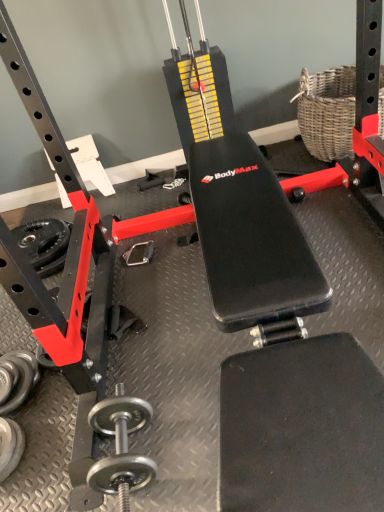
Identify the location of silver metallic dumbbell at lower left, marked as the first dumbbell in a left-to-right arrangement. This screenshot has height=512, width=384. (17, 379).

You are a GUI agent. You are given a task and a screenshot of the screen. Output one action in this format:
    pyautogui.click(x=<x>, y=<y>)
    Task: Click on the woven wicker basket at upper right
    The height and width of the screenshot is (512, 384).
    Given the screenshot: What is the action you would take?
    pyautogui.click(x=327, y=112)

Locate an element on the screen. This screenshot has width=384, height=512. rubberized black weight at lower left is located at coordinates (43, 240).

Is silver metallic dumbbell at lower left, which is the third dumbbell in right-to-left order, oriented away from rubberized black weight at lower left?

No.

Does silver metallic dumbbell at lower left, marked as the first dumbbell in a left-to-right arrangement, appear on the right side of rubberized black weight at lower left?

Correct, you'll find silver metallic dumbbell at lower left, marked as the first dumbbell in a left-to-right arrangement, to the right of rubberized black weight at lower left.

From the image's perspective, which is above, silver metallic dumbbell at lower left, marked as the first dumbbell in a left-to-right arrangement, or rubberized black weight at lower left?

From the image's view, rubberized black weight at lower left is above.

From a real-world perspective, is silver metallic dumbbell at lower left, which is the third dumbbell in right-to-left order, beneath rubberized black weight at lower left?

Yes, from a real-world perspective, silver metallic dumbbell at lower left, which is the third dumbbell in right-to-left order, is under rubberized black weight at lower left.

In terms of width, does woven wicker basket at upper right look wider or thinner when compared to silver metallic dumbbell at lower left, the 2th dumbbell positioned from the left?

Considering their sizes, woven wicker basket at upper right looks broader than silver metallic dumbbell at lower left, the 2th dumbbell positioned from the left.

From a real-world perspective, is woven wicker basket at upper right on top of silver metallic dumbbell at lower left, placed as the 2th dumbbell when sorted from right to left?

Yes, from a real-world perspective, woven wicker basket at upper right is over silver metallic dumbbell at lower left, placed as the 2th dumbbell when sorted from right to left

Is woven wicker basket at upper right taller than silver metallic dumbbell at lower left, placed as the 2th dumbbell when sorted from right to left?

Yes, woven wicker basket at upper right is taller than silver metallic dumbbell at lower left, placed as the 2th dumbbell when sorted from right to left.

Is point (59, 227) behind point (338, 71)?

No, (59, 227) is closer to viewer.

Consider the image. Is rubberized black weight at lower left at the right side of woven wicker basket at upper right?

No.

Which object is closer to the camera taking this photo, rubberized black weight at lower left or woven wicker basket at upper right?

woven wicker basket at upper right is closer to the camera.

From the image's perspective, is rubberized black weight at lower left on woven wicker basket at upper right?

Incorrect, from the image's perspective, rubberized black weight at lower left is lower than woven wicker basket at upper right.

Is the depth of silver metallic dumbbell at lower left, placed as the 2th dumbbell when sorted from right to left, greater than that of rubberized black weight at lower left?

No, silver metallic dumbbell at lower left, placed as the 2th dumbbell when sorted from right to left, is closer to the viewer.

From the image's perspective, between silver metallic dumbbell at lower left, the 2th dumbbell positioned from the left, and rubberized black weight at lower left, which one is located above?

From the image's view, rubberized black weight at lower left is above.

Is point (0, 463) positioned behind point (48, 254)?

That is False.

Can you see silver metallic dumbbell at lower left, placed as the 2th dumbbell when sorted from right to left, touching rubberized black weight at lower left?

No, silver metallic dumbbell at lower left, placed as the 2th dumbbell when sorted from right to left, is not beside rubberized black weight at lower left.

Is polished silver dumbbell at lower left, marked as the first dumbbell in a right-to-left arrangement, thinner than silver metallic dumbbell at lower left, the 2th dumbbell positioned from the left?

Incorrect, the width of polished silver dumbbell at lower left, marked as the first dumbbell in a right-to-left arrangement, is not less than that of silver metallic dumbbell at lower left, the 2th dumbbell positioned from the left.

Visually, is polished silver dumbbell at lower left, marked as the first dumbbell in a right-to-left arrangement, positioned to the left or to the right of silver metallic dumbbell at lower left, the 2th dumbbell positioned from the left?

Clearly, polished silver dumbbell at lower left, marked as the first dumbbell in a right-to-left arrangement, is on the right of silver metallic dumbbell at lower left, the 2th dumbbell positioned from the left, in the image.

Could you measure the distance between polished silver dumbbell at lower left, marked as the first dumbbell in a right-to-left arrangement, and silver metallic dumbbell at lower left, placed as the 2th dumbbell when sorted from right to left?

The distance of polished silver dumbbell at lower left, marked as the first dumbbell in a right-to-left arrangement, from silver metallic dumbbell at lower left, placed as the 2th dumbbell when sorted from right to left, is 12.83 inches.

Who is taller, polished silver dumbbell at lower left, which ranks as the third dumbbell in left-to-right order, or silver metallic dumbbell at lower left, the 2th dumbbell positioned from the left?

With more height is polished silver dumbbell at lower left, which ranks as the third dumbbell in left-to-right order.

Is woven wicker basket at upper right oriented away from polished silver dumbbell at lower left, marked as the first dumbbell in a right-to-left arrangement?

woven wicker basket at upper right is not turned away from polished silver dumbbell at lower left, marked as the first dumbbell in a right-to-left arrangement.

Which of these two, woven wicker basket at upper right or polished silver dumbbell at lower left, which ranks as the third dumbbell in left-to-right order, is bigger?

woven wicker basket at upper right is bigger.

Is woven wicker basket at upper right positioned in front of polished silver dumbbell at lower left, which ranks as the third dumbbell in left-to-right order?

No, woven wicker basket at upper right is further to the viewer.

In terms of height, does silver metallic dumbbell at lower left, which is the third dumbbell in right-to-left order, look taller or shorter compared to polished silver dumbbell at lower left, marked as the first dumbbell in a right-to-left arrangement?

Considering their sizes, silver metallic dumbbell at lower left, which is the third dumbbell in right-to-left order, has less height than polished silver dumbbell at lower left, marked as the first dumbbell in a right-to-left arrangement.

Which is more to the left, silver metallic dumbbell at lower left, marked as the first dumbbell in a left-to-right arrangement, or polished silver dumbbell at lower left, marked as the first dumbbell in a right-to-left arrangement?

silver metallic dumbbell at lower left, marked as the first dumbbell in a left-to-right arrangement.

From the image's perspective, which is below, silver metallic dumbbell at lower left, which is the third dumbbell in right-to-left order, or polished silver dumbbell at lower left, which ranks as the third dumbbell in left-to-right order?

polished silver dumbbell at lower left, which ranks as the third dumbbell in left-to-right order, appears lower in the image.

This screenshot has width=384, height=512. In order to click on wheel above the silver metallic dumbbell at lower left, marked as the first dumbbell in a left-to-right arrangement (from the image's perspective) in this screenshot , I will do `click(43, 240)`.

Find the location of a particular element. the 2nd dumbbell to the left when counting from the woven wicker basket at upper right is located at coordinates (10, 446).

Looking at the image, which one is located further to polished silver dumbbell at lower left, which ranks as the third dumbbell in left-to-right order, silver metallic dumbbell at lower left, placed as the 2th dumbbell when sorted from right to left, or silver metallic dumbbell at lower left, marked as the first dumbbell in a left-to-right arrangement?

Among the two, silver metallic dumbbell at lower left, marked as the first dumbbell in a left-to-right arrangement, is located further to polished silver dumbbell at lower left, which ranks as the third dumbbell in left-to-right order.

From the image, which object appears to be nearer to silver metallic dumbbell at lower left, placed as the 2th dumbbell when sorted from right to left, polished silver dumbbell at lower left, which ranks as the third dumbbell in left-to-right order, or woven wicker basket at upper right?

polished silver dumbbell at lower left, which ranks as the third dumbbell in left-to-right order, is positioned closer to the anchor silver metallic dumbbell at lower left, placed as the 2th dumbbell when sorted from right to left.

When comparing their distances from silver metallic dumbbell at lower left, the 2th dumbbell positioned from the left, does woven wicker basket at upper right or polished silver dumbbell at lower left, which ranks as the third dumbbell in left-to-right order, seem closer?

The object closer to silver metallic dumbbell at lower left, the 2th dumbbell positioned from the left, is polished silver dumbbell at lower left, which ranks as the third dumbbell in left-to-right order.

Looking at the image, which one is located further to woven wicker basket at upper right, polished silver dumbbell at lower left, which ranks as the third dumbbell in left-to-right order, or silver metallic dumbbell at lower left, placed as the 2th dumbbell when sorted from right to left?

silver metallic dumbbell at lower left, placed as the 2th dumbbell when sorted from right to left, lies further to woven wicker basket at upper right than the other object.

Consider the image. From the image, which object appears to be nearer to rubberized black weight at lower left, silver metallic dumbbell at lower left, placed as the 2th dumbbell when sorted from right to left, or polished silver dumbbell at lower left, marked as the first dumbbell in a right-to-left arrangement?

silver metallic dumbbell at lower left, placed as the 2th dumbbell when sorted from right to left, lies closer to rubberized black weight at lower left than the other object.

Based on their spatial positions, is polished silver dumbbell at lower left, which ranks as the third dumbbell in left-to-right order, or rubberized black weight at lower left further from woven wicker basket at upper right?

polished silver dumbbell at lower left, which ranks as the third dumbbell in left-to-right order, is further to woven wicker basket at upper right.

Based on their spatial positions, is polished silver dumbbell at lower left, which ranks as the third dumbbell in left-to-right order, or silver metallic dumbbell at lower left, which is the third dumbbell in right-to-left order, closer to rubberized black weight at lower left?

The object closer to rubberized black weight at lower left is silver metallic dumbbell at lower left, which is the third dumbbell in right-to-left order.

Based on their spatial positions, is woven wicker basket at upper right or rubberized black weight at lower left further from silver metallic dumbbell at lower left, which is the third dumbbell in right-to-left order?

Among the two, woven wicker basket at upper right is located further to silver metallic dumbbell at lower left, which is the third dumbbell in right-to-left order.

Find the location of a particular element. The height and width of the screenshot is (512, 384). dumbbell between silver metallic dumbbell at lower left, which is the third dumbbell in right-to-left order, and polished silver dumbbell at lower left, which ranks as the third dumbbell in left-to-right order, in the horizontal direction is located at coordinates (10, 446).